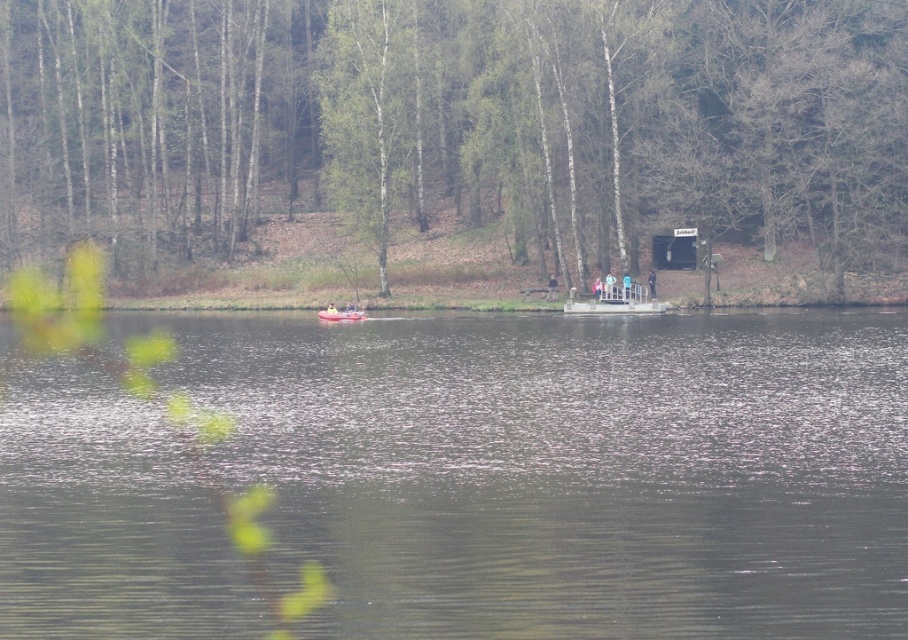
You are standing on the lakeside and want to take a photo of the transparent water at center and the green matte tree at center. Which object will appear taller in the photo?

The green matte tree at center will appear taller in the photo because it has a greater height compared to the transparent water at center.

You are standing on the lakeshore and want to take a photo of the transparent water at center and the rubber boat at center. Which object will appear larger in your photo?

The transparent water at center will appear larger in the photo because it is closer to the viewer than the rubber boat at center.

You are a photographer planning to capture the reflection of the transparent water at center and the rubber boat at center in the lake. Since the water surface is calm, you want to ensure both elements are fully visible in the reflection. Given the scene described, which object will have a wider reflection in the water?

The transparent water at center has a wider reflection than the rubber boat at center because its width surpasses that of the rubber boat at center, as stated in the objects description.